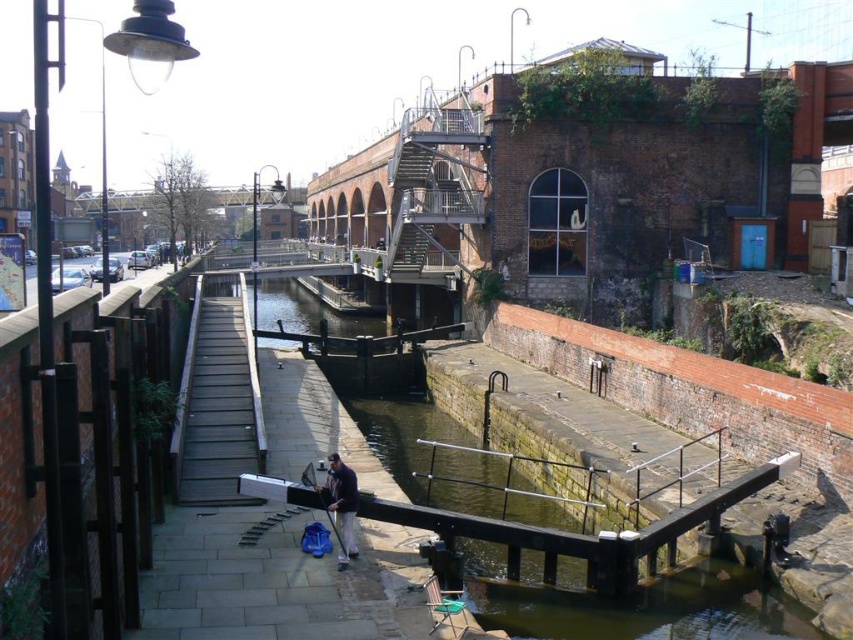
Can you confirm if wooden planks dock at center is positioned to the right of dark blue fabric at center?

No, wooden planks dock at center is not to the right of dark blue fabric at center.

Who is taller, wooden planks dock at center or dark blue fabric at center?

wooden planks dock at center

Which is in front, point (210, 486) or point (334, 476)?

Positioned in front is point (334, 476).

Where is `wooden planks dock at center`? This screenshot has width=853, height=640. wooden planks dock at center is located at coordinates (218, 403).